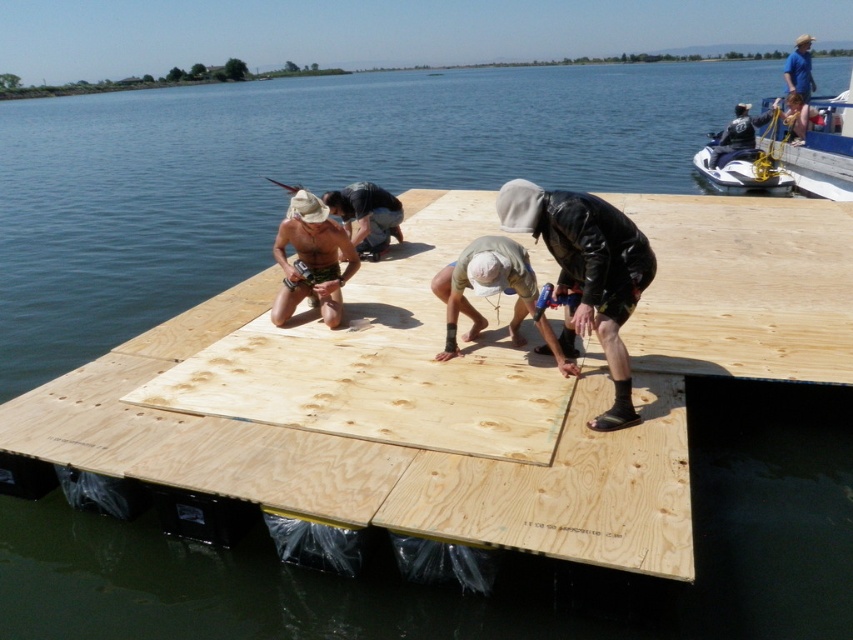
You are a construction worker standing on the floating platform and need to reach two points marked on the platform. The first point is at coordinates point (550, 240) and the second point is at point (398, 234). Which point should you reach first if you want to move from the nearest point to the farthest point?

You should first reach point (550, 240) because it is closer to you than point (398, 234), so moving from nearest to farthest would start with the closer point.

Based on the photo, you are a photographer standing at the edge of the platform and see the black leather jacket at center. You want to take a photo of the jacket but your camera is at your side. Can you reach your camera to take a photo of the jacket without moving from your current position?

The black leather jacket at center and camera are 4.32 meters apart. Since the distance between them is greater than the typical arm length, you cannot reach the camera to take a photo of the jacket without moving.

Looking at this image, you are a construction worker observing the scene. You notice two workers at the center of the platform wearing black leather jacket at center and matte black shirt at center. Which worker is closer to the water surface?

The black leather jacket at center is positioned under matte black shirt at center, so the worker wearing the black leather jacket at center is closer to the water surface.